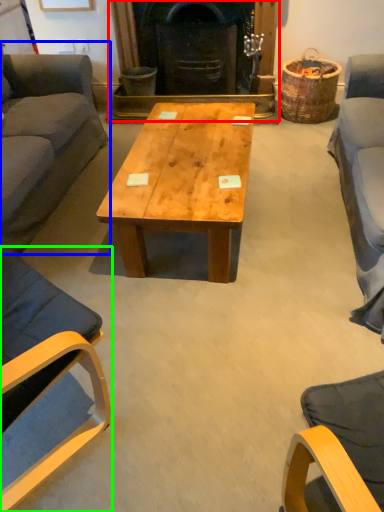
Question: Estimate the real-world distances between objects in this image. Which object is farther from fireplace (highlighted by a red box), studio couch (highlighted by a blue box) or chair (highlighted by a green box)?

Choices:
 (A) studio couch
 (B) chair

Answer: (B)